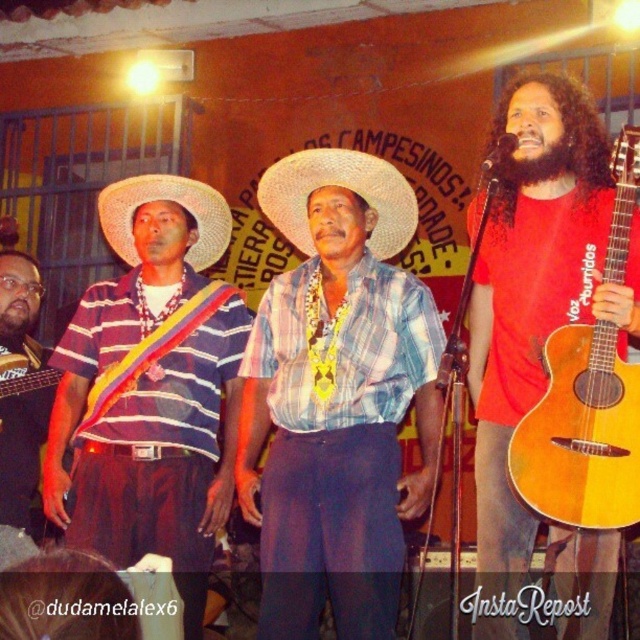
Question: Is blue plaid shirt at center behind striped fabric shirt at center?

Choices:
 (A) no
 (B) yes

Answer: (A)

Question: Considering the real-world distances, which object is closest to the strawhat at left?

Choices:
 (A) natural wood acoustic guitar at right
 (B) striped fabric shirt at center
 (C) dark brown curly beard at upper right
 (D) striped fabric shirt at left

Answer: (B)

Question: Among these points, which one is nearest to the camera?

Choices:
 (A) (392, 196)
 (B) (228, 228)

Answer: (A)

Question: Which of the following is the farthest from the observer?

Choices:
 (A) click(x=396, y=248)
 (B) click(x=4, y=280)

Answer: (B)

Question: Does striped fabric shirt at center appear on the right side of natural wood acoustic guitar at right?

Choices:
 (A) yes
 (B) no

Answer: (B)

Question: Does striped fabric shirt at center have a larger size compared to dark brown curly beard at upper right?

Choices:
 (A) no
 (B) yes

Answer: (B)